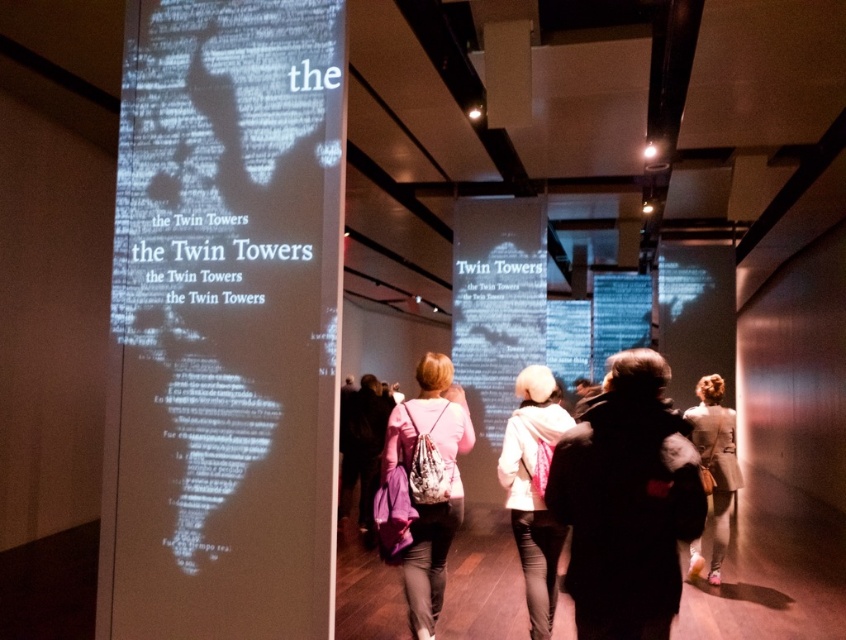
Question: Observing the image, what is the correct spatial positioning of white fleece jacket at center in reference to light beige coat at lower right?

Choices:
 (A) below
 (B) above

Answer: (B)

Question: Does white fleece jacket at center have a smaller size compared to light beige coat at lower right?

Choices:
 (A) no
 (B) yes

Answer: (B)

Question: Which of these objects is positioned closest to the pink fabric bag at center?

Choices:
 (A) light beige coat at lower right
 (B) black fuzzy coat at center
 (C) white fleece jacket at center

Answer: (C)

Question: Estimate the real-world distances between objects in this image. Which object is closer to the light beige coat at lower right?

Choices:
 (A) white fleece jacket at center
 (B) black fuzzy coat at center
 (C) pink fabric bag at center

Answer: (A)

Question: In this image, where is black fuzzy coat at center located relative to light beige coat at lower right?

Choices:
 (A) left
 (B) right

Answer: (A)

Question: Which point is closer to the camera?

Choices:
 (A) white fleece jacket at center
 (B) black fuzzy coat at center

Answer: (B)